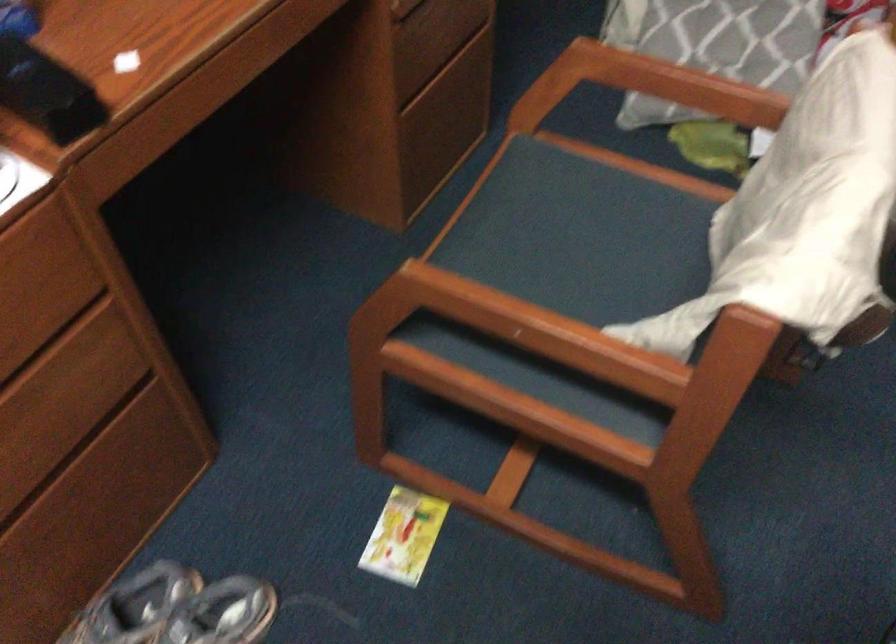
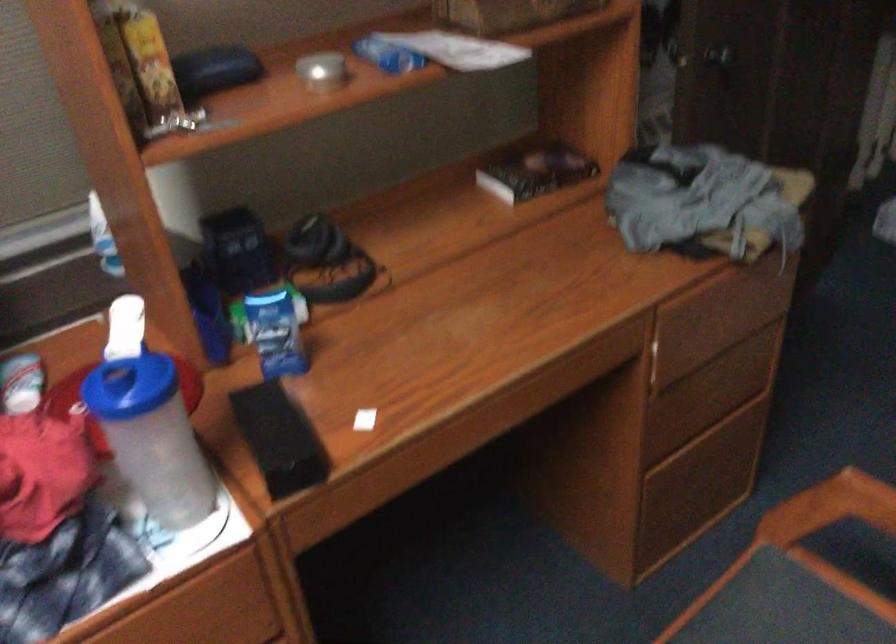
Looking at this image, which direction would the cameraman need to move to produce the second image?

The cameraman walked toward right, forward.